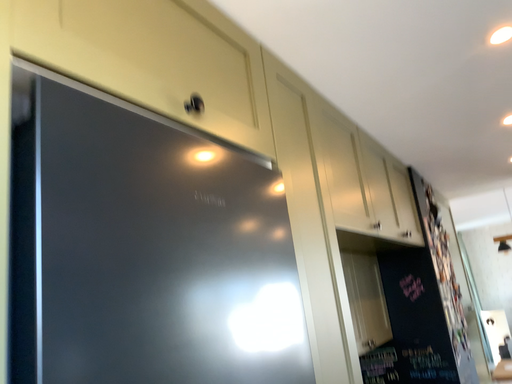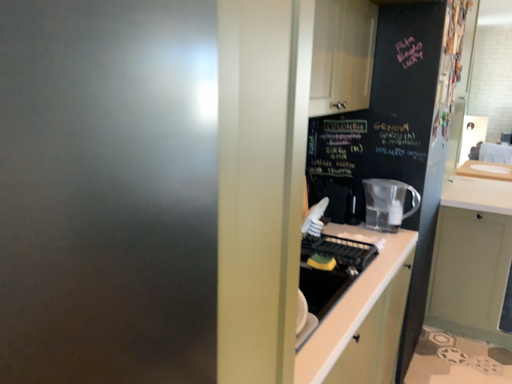
Question: How did the camera likely rotate when shooting the video?

Choices:
 (A) rotated upward
 (B) rotated downward

Answer: (B)